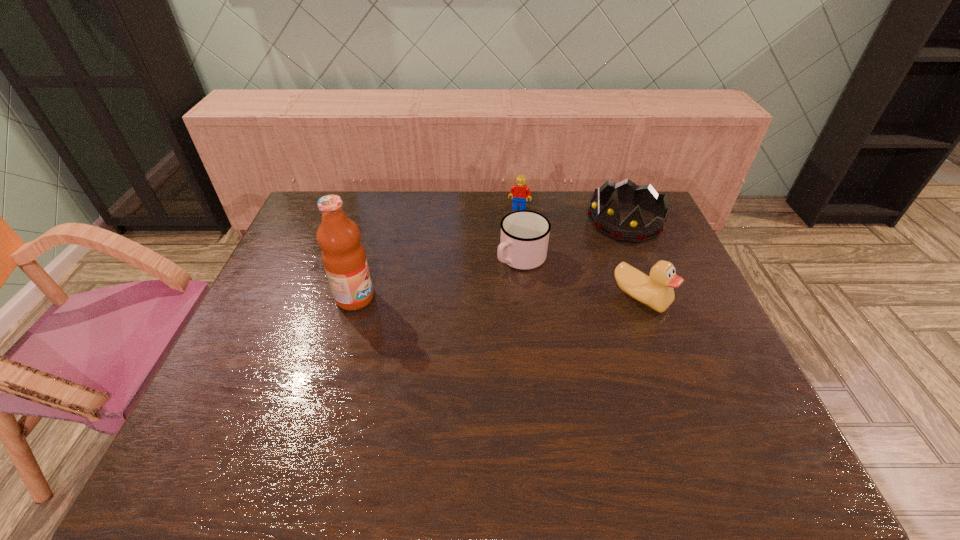
The width and height of the screenshot is (960, 540). I want to click on free spot between the duck and the second tallest object, so click(633, 260).

You are a GUI agent. You are given a task and a screenshot of the screen. Output one action in this format:
    pyautogui.click(x=<x>, y=<y>)
    Task: Click on the free point between the tallest object and the mug
    The height and width of the screenshot is (540, 960).
    Given the screenshot: What is the action you would take?
    pyautogui.click(x=439, y=278)

At what (x,y) coordinates should I click in order to perform the action: click on vacant region between the leftmost object and the Lego. Please return your answer as a coordinate pair (x, y). Looking at the image, I should click on (437, 253).

You are a GUI agent. You are given a task and a screenshot of the screen. Output one action in this format:
    pyautogui.click(x=<x>, y=<y>)
    Task: Click on the vacant region between the fourth shortest object and the duck
    This screenshot has width=960, height=540.
    Given the screenshot: What is the action you would take?
    pyautogui.click(x=633, y=260)

Locate an element on the screen. The width and height of the screenshot is (960, 540). vacant area between the mug and the second tallest object is located at coordinates (573, 240).

At what (x,y) coordinates should I click in order to perform the action: click on unoccupied area between the second tallest object and the Lego. Please return your answer as a coordinate pair (x, y). This screenshot has height=540, width=960. Looking at the image, I should click on (572, 215).

In order to click on free space between the Lego and the tallest object in this screenshot , I will do `click(437, 253)`.

Select which object appears as the third closest to the duck. Please provide its 2D coordinates. Your answer should be formatted as a tuple, i.e. [(x, y)], where the tuple contains the x and y coordinates of a point satisfying the conditions above.

[(519, 192)]

Choose which object is the nearest neighbor to the fourth shortest object. Please provide its 2D coordinates. Your answer should be formatted as a tuple, i.e. [(x, y)], where the tuple contains the x and y coordinates of a point satisfying the conditions above.

[(656, 291)]

In order to click on vacant region that satisfies the following two spatial constraints: 1. on the back side of the mug; 2. on the left side of the tiara in this screenshot , I will do `click(517, 221)`.